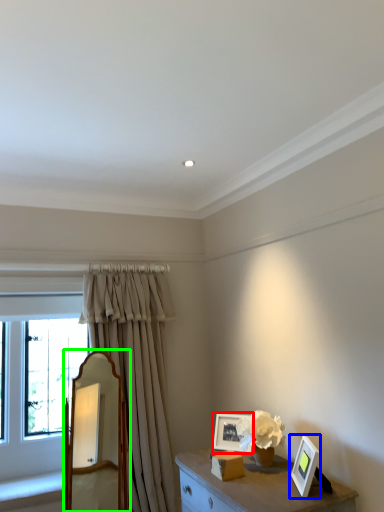
Question: Which object is the farthest from picture frame (highlighted by a red box)? Choose among these: picture frame (highlighted by a blue box) or mirror (highlighted by a green box).

Choices:
 (A) picture frame
 (B) mirror

Answer: (B)